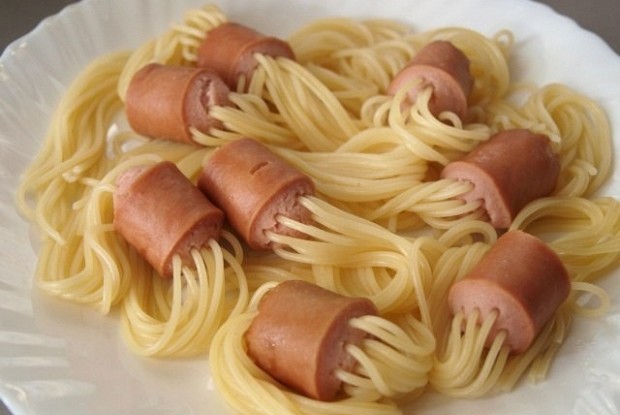
You are a GUI agent. You are given a task and a screenshot of the screen. Output one action in this format:
    pyautogui.click(x=<x>, y=<y>)
    Task: Click on the plate
    The image size is (620, 415).
    Given the screenshot: What is the action you would take?
    pyautogui.click(x=111, y=361)